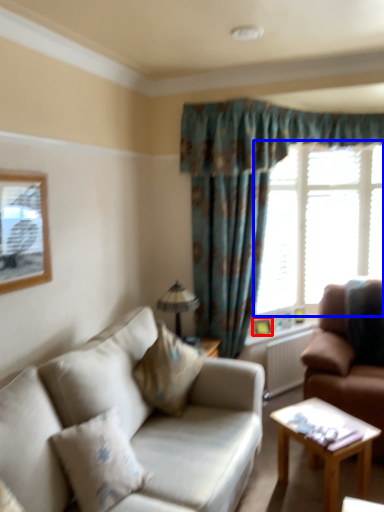
Question: Which object appears closest to the camera in this image, picture frame (highlighted by a red box) or window (highlighted by a blue box)?

Choices:
 (A) picture frame
 (B) window

Answer: (A)